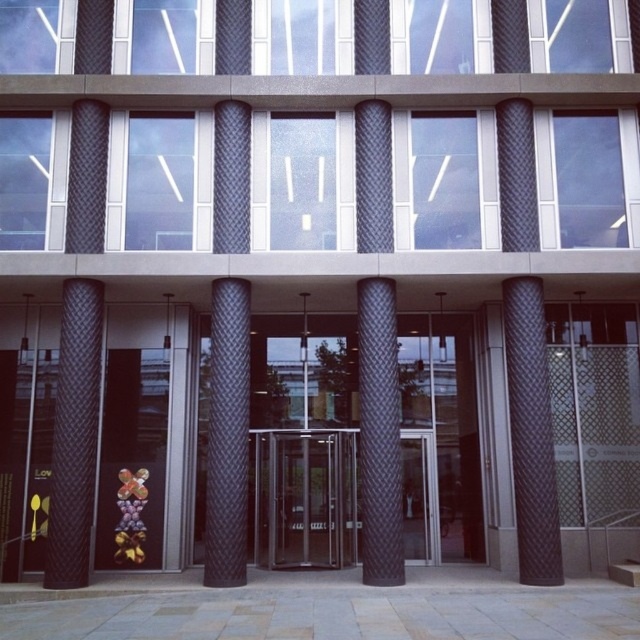
Question: Which object is the farthest from the metallic gold flower at lower center?

Choices:
 (A) black textured column at center
 (B) black quilted pillar at left
 (C) black quilted fabric pillar at right

Answer: (C)

Question: Is black textured column at center positioned at the back of metallic gold flower at lower center?

Choices:
 (A) no
 (B) yes

Answer: (A)

Question: Which point is farther to the camera?

Choices:
 (A) black textured column at center
 (B) metallic gold flower at lower center
 (C) black textured pillar at center

Answer: (B)

Question: Estimate the real-world distances between objects in this image. Which object is closer to the metallic gold flower at lower center?

Choices:
 (A) black quilted pillar at left
 (B) black textured pillar at center
 (C) black textured column at center

Answer: (A)

Question: Does black quilted fabric pillar at right appear under black textured column at center?

Choices:
 (A) no
 (B) yes

Answer: (A)

Question: Is black quilted fabric pillar at right further to the viewer compared to black textured column at center?

Choices:
 (A) yes
 (B) no

Answer: (B)